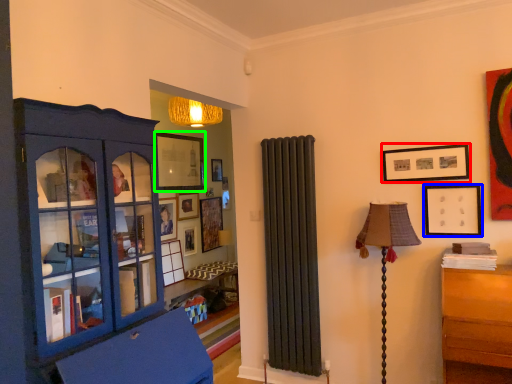
Question: Which object is the farthest from picture frame (highlighted by a red box)? Choose among these: picture frame (highlighted by a blue box) or picture frame (highlighted by a green box).

Choices:
 (A) picture frame
 (B) picture frame

Answer: (B)